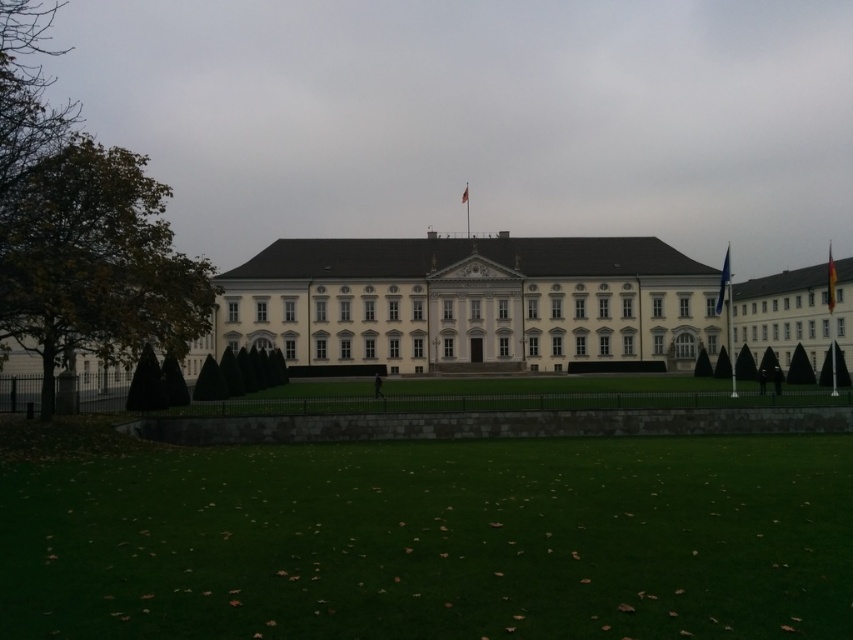
Question: Which point is farther to the camera?

Choices:
 (A) coord(805,522)
 (B) coord(103,285)

Answer: (B)

Question: Considering the relative positions of green grass at lower center and green leafy tree at left in the image provided, where is green grass at lower center located with respect to green leafy tree at left?

Choices:
 (A) below
 (B) above

Answer: (A)

Question: Is green grass at lower center thinner than green leafy tree at left?

Choices:
 (A) no
 (B) yes

Answer: (A)

Question: Which of the following is the closest to the observer?

Choices:
 (A) green leafy tree at left
 (B) green grass at lower center

Answer: (B)

Question: Can you confirm if green grass at lower center is wider than green leafy tree at left?

Choices:
 (A) no
 (B) yes

Answer: (B)